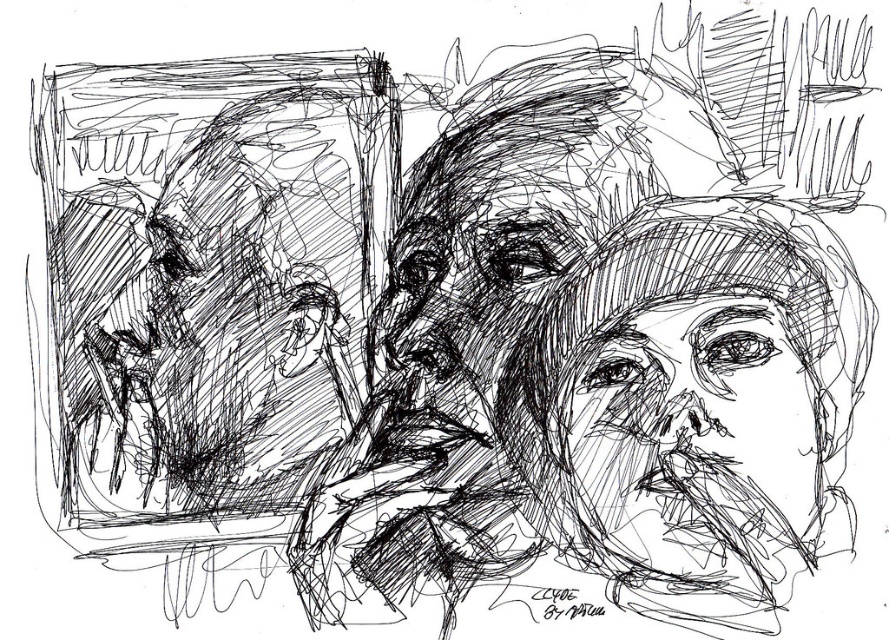
Can you confirm if black ink sketch of face at center is bigger than smooth black face at center?

Correct, black ink sketch of face at center is larger in size than smooth black face at center.

Describe the element at coordinates (683, 401) in the screenshot. This screenshot has width=889, height=640. I see `black ink sketch of face at center` at that location.

At what (x,y) coordinates should I click in order to perform the action: click on black ink sketch of face at center. Please return your answer as a coordinate pair (x, y). Image resolution: width=889 pixels, height=640 pixels. Looking at the image, I should click on (683, 401).